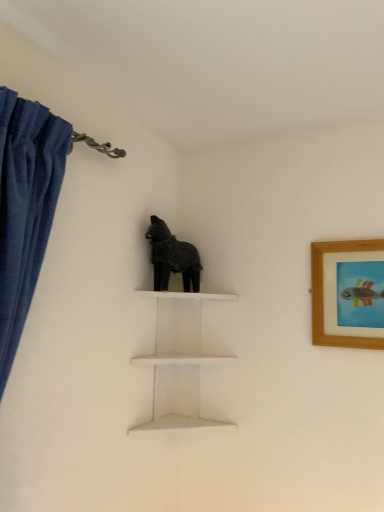
Measure the distance between point (345, 249) and camera.

The distance of point (345, 249) from camera is 4.43 feet.

Describe the element at coordinates (172, 257) in the screenshot. This screenshot has height=512, width=384. I see `fuzzy black dog at center` at that location.

Image resolution: width=384 pixels, height=512 pixels. In order to click on wooden framed picture at upper right in this screenshot , I will do `click(348, 293)`.

Between wooden framed picture at upper right and white matte shelf at center, which one appears on the left side from the viewer's perspective?

From the viewer's perspective, white matte shelf at center appears more on the left side.

Who is smaller, wooden framed picture at upper right or white matte shelf at center?

Smaller between the two is wooden framed picture at upper right.

From a real-world perspective, between wooden framed picture at upper right and white matte shelf at center, who is vertically lower?

white matte shelf at center.

Can you confirm if white matte shelf at center is taller than fuzzy black dog at center?

Indeed, white matte shelf at center has a greater height compared to fuzzy black dog at center.

Which object is thinner, white matte shelf at center or fuzzy black dog at center?

Thinner between the two is fuzzy black dog at center.

Between point (184, 344) and point (151, 234), which one is positioned behind?

Positioned behind is point (184, 344).

Would you say white matte shelf at center is a long distance from fuzzy black dog at center?

They are positioned close to each other.

From a real-world perspective, relative to wooden framed picture at upper right, is white matte shelf at center vertically above or below?

Clearly, from a real-world perspective, white matte shelf at center is below wooden framed picture at upper right.

Is white matte shelf at center far away from wooden framed picture at upper right?

white matte shelf at center is actually quite close to wooden framed picture at upper right.

From the image's perspective, is white matte shelf at center positioned above or below wooden framed picture at upper right?

From the image's perspective, white matte shelf at center appears below wooden framed picture at upper right.

Is fuzzy black dog at center inside wooden framed picture at upper right?

Actually, fuzzy black dog at center is outside wooden framed picture at upper right.

How far apart are wooden framed picture at upper right and fuzzy black dog at center?

A distance of 20.49 inches exists between wooden framed picture at upper right and fuzzy black dog at center.

From a real-world perspective, between wooden framed picture at upper right and fuzzy black dog at center, who is vertically higher?

fuzzy black dog at center, from a real-world perspective.

From the image's perspective, which is above, wooden framed picture at upper right or fuzzy black dog at center?

From the image's view, fuzzy black dog at center is above.

From the picture: Can you tell me how much fuzzy black dog at center and white matte shelf at center differ in facing direction?

30.9 degrees separate the facing orientations of fuzzy black dog at center and white matte shelf at center.

Is fuzzy black dog at center facing towards white matte shelf at center?

No.

Where is `shelf below the fuzzy black dog at center (from the image's perspective)`? shelf below the fuzzy black dog at center (from the image's perspective) is located at coordinates (179, 361).

Is there a large distance between fuzzy black dog at center and white matte shelf at center?

Actually, fuzzy black dog at center and white matte shelf at center are a little close together.

Could wooden framed picture at upper right be considered to be inside fuzzy black dog at center?

That's incorrect, wooden framed picture at upper right is not inside fuzzy black dog at center.

From a real-world perspective, which object rests below the other?

In real-world perspective, wooden framed picture at upper right is lower.

Considering the relative positions of fuzzy black dog at center and wooden framed picture at upper right in the image provided, is fuzzy black dog at center to the right of wooden framed picture at upper right from the viewer's perspective?

In fact, fuzzy black dog at center is to the left of wooden framed picture at upper right.

Is fuzzy black dog at center facing towards wooden framed picture at upper right?

No, fuzzy black dog at center is not oriented towards wooden framed picture at upper right.

Image resolution: width=384 pixels, height=512 pixels. I want to click on shelf behind the wooden framed picture at upper right, so click(179, 361).

This screenshot has width=384, height=512. I want to click on shelf on the right of fuzzy black dog at center, so click(179, 361).

From the image, which object appears to be farther from white matte shelf at center, fuzzy black dog at center or wooden framed picture at upper right?

Among the two, wooden framed picture at upper right is located further to white matte shelf at center.

Based on their spatial positions, is wooden framed picture at upper right or fuzzy black dog at center closer to white matte shelf at center?

fuzzy black dog at center.

Considering their positions, is white matte shelf at center positioned further to wooden framed picture at upper right than fuzzy black dog at center?

fuzzy black dog at center is further to wooden framed picture at upper right.

Which object lies nearer to the anchor point fuzzy black dog at center, white matte shelf at center or wooden framed picture at upper right?

white matte shelf at center is positioned closer to the anchor fuzzy black dog at center.

Estimate the real-world distances between objects in this image. Which object is closer to wooden framed picture at upper right, fuzzy black dog at center or white matte shelf at center?

white matte shelf at center is closer to wooden framed picture at upper right.

Which object lies further to the anchor point fuzzy black dog at center, wooden framed picture at upper right or white matte shelf at center?

wooden framed picture at upper right is positioned further to the anchor fuzzy black dog at center.

Where is `shelf located between fuzzy black dog at center and wooden framed picture at upper right in the left-right direction`? shelf located between fuzzy black dog at center and wooden framed picture at upper right in the left-right direction is located at coordinates (179, 361).